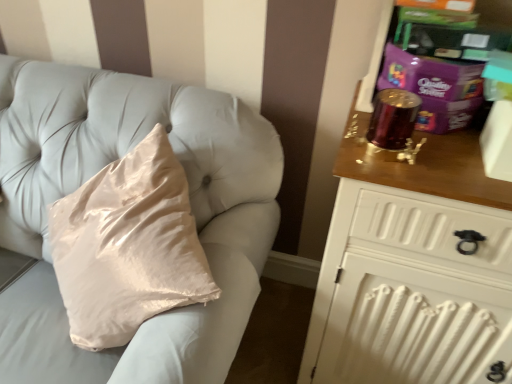
Question: Does point (265, 162) appear closer or farther from the camera than point (450, 271)?

Choices:
 (A) farther
 (B) closer

Answer: (A)

Question: Is silky beige pillow at upper left bigger or smaller than wooden chest of drawers at right?

Choices:
 (A) small
 (B) big

Answer: (A)

Question: Is silky beige pillow at upper left in front of or behind wooden chest of drawers at right in the image?

Choices:
 (A) front
 (B) behind

Answer: (B)

Question: In the image, is wooden chest of drawers at right positioned in front of or behind silky beige pillow at upper left?

Choices:
 (A) behind
 (B) front

Answer: (B)

Question: In terms of width, does wooden chest of drawers at right look wider or thinner when compared to silky beige pillow at upper left?

Choices:
 (A) wide
 (B) thin

Answer: (A)

Question: Looking at the image, does wooden chest of drawers at right seem bigger or smaller compared to silky beige pillow at upper left?

Choices:
 (A) big
 (B) small

Answer: (A)

Question: Is wooden chest of drawers at right spatially inside silky beige pillow at upper left, or outside of it?

Choices:
 (A) inside
 (B) outside

Answer: (B)